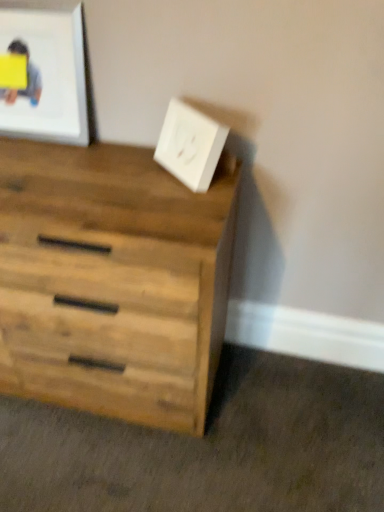
Question: Is natural wood chest of drawers at lower left outside of white matte electric outlet at upper right?

Choices:
 (A) yes
 (B) no

Answer: (A)

Question: Is natural wood chest of drawers at lower left facing away from white matte electric outlet at upper right?

Choices:
 (A) no
 (B) yes

Answer: (A)

Question: Does natural wood chest of drawers at lower left appear on the right side of white matte electric outlet at upper right?

Choices:
 (A) no
 (B) yes

Answer: (A)

Question: Is natural wood chest of drawers at lower left shorter than white matte electric outlet at upper right?

Choices:
 (A) yes
 (B) no

Answer: (B)

Question: Are natural wood chest of drawers at lower left and white matte electric outlet at upper right beside each other?

Choices:
 (A) yes
 (B) no

Answer: (B)

Question: From the image's perspective, is natural wood chest of drawers at lower left above white matte electric outlet at upper right?

Choices:
 (A) no
 (B) yes

Answer: (A)

Question: Considering the relative positions of yellow paper at upper left and white matte electric outlet at upper right in the image provided, is yellow paper at upper left in front of white matte electric outlet at upper right?

Choices:
 (A) yes
 (B) no

Answer: (B)

Question: Is yellow paper at upper left shorter than white matte electric outlet at upper right?

Choices:
 (A) no
 (B) yes

Answer: (B)

Question: Is yellow paper at upper left oriented towards white matte electric outlet at upper right?

Choices:
 (A) no
 (B) yes

Answer: (A)

Question: Is yellow paper at upper left positioned beyond the bounds of white matte electric outlet at upper right?

Choices:
 (A) yes
 (B) no

Answer: (A)

Question: From a real-world perspective, is yellow paper at upper left below white matte electric outlet at upper right?

Choices:
 (A) no
 (B) yes

Answer: (A)

Question: Is yellow paper at upper left at the left side of white matte electric outlet at upper right?

Choices:
 (A) yes
 (B) no

Answer: (A)

Question: Is yellow paper at upper left in front of natural wood chest of drawers at lower left?

Choices:
 (A) no
 (B) yes

Answer: (A)